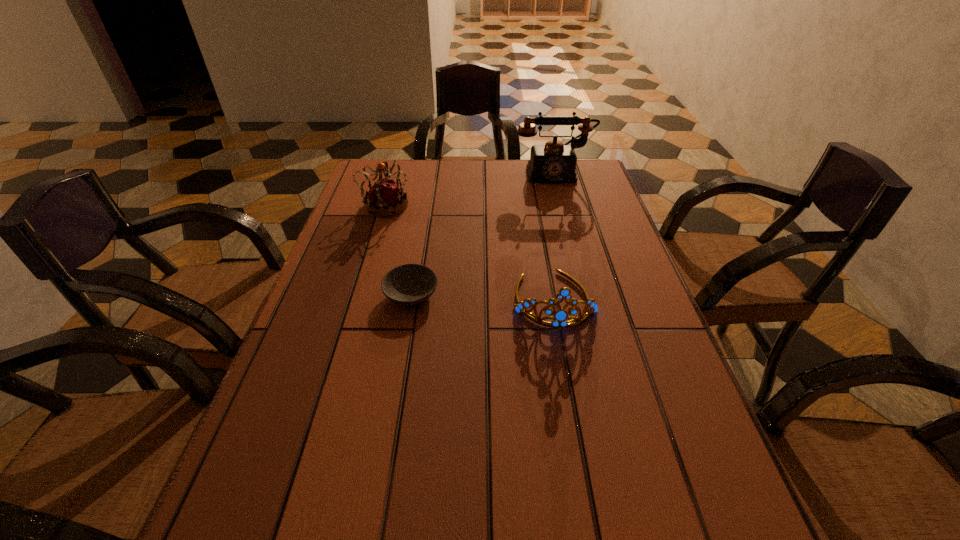
Locate an element on the screen. Image resolution: width=960 pixels, height=540 pixels. blank space located 0.370m on the front of the bowl is located at coordinates (379, 482).

The height and width of the screenshot is (540, 960). Find the location of `telephone present at the far edge`. telephone present at the far edge is located at coordinates (555, 162).

What are the coordinates of `tiara at the far edge` in the screenshot? It's located at (384, 197).

At what (x,y) coordinates should I click in order to perform the action: click on object that is at the left edge. Please return your answer as a coordinate pair (x, y). This screenshot has width=960, height=540. Looking at the image, I should click on (384, 197).

At what (x,y) coordinates should I click in order to perform the action: click on telephone located in the right edge section of the desktop. Please return your answer as a coordinate pair (x, y). Image resolution: width=960 pixels, height=540 pixels. Looking at the image, I should click on (555, 162).

At what (x,y) coordinates should I click in order to perform the action: click on tiara at the right edge. Please return your answer as a coordinate pair (x, y). This screenshot has height=540, width=960. Looking at the image, I should click on (559, 318).

At what (x,y) coordinates should I click in order to perform the action: click on object at the far left corner. Please return your answer as a coordinate pair (x, y). Looking at the image, I should click on (384, 197).

Find the location of a particular element. object that is at the far right corner is located at coordinates (555, 162).

In the image, there is a desktop. Find the location of `free space at the far edge`. free space at the far edge is located at coordinates (515, 168).

What are the coordinates of `free space at the left edge of the desktop` in the screenshot? It's located at (367, 268).